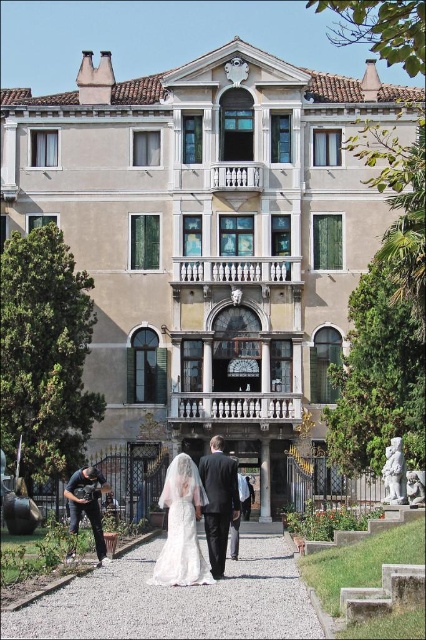
Question: Which is farther from the white lace dress at center?

Choices:
 (A) gray gravel path at center
 (B) dark gray fabric jacket at lower left

Answer: (B)

Question: Can you confirm if gray gravel path at center is positioned to the right of dark gray suit at center?

Choices:
 (A) yes
 (B) no

Answer: (B)

Question: In this image, where is gray gravel path at center located relative to dark gray suit at center?

Choices:
 (A) below
 (B) above

Answer: (A)

Question: Which is nearer to the dark gray suit at center?

Choices:
 (A) gray gravel path at center
 (B) dark gray fabric jacket at lower left

Answer: (A)

Question: Does white lace dress at center come in front of dark gray fabric jacket at lower left?

Choices:
 (A) no
 (B) yes

Answer: (B)

Question: Which point is closer to the camera taking this photo?

Choices:
 (A) (212, 509)
 (B) (285, 584)
 (C) (187, 468)
 (D) (97, 556)

Answer: (B)